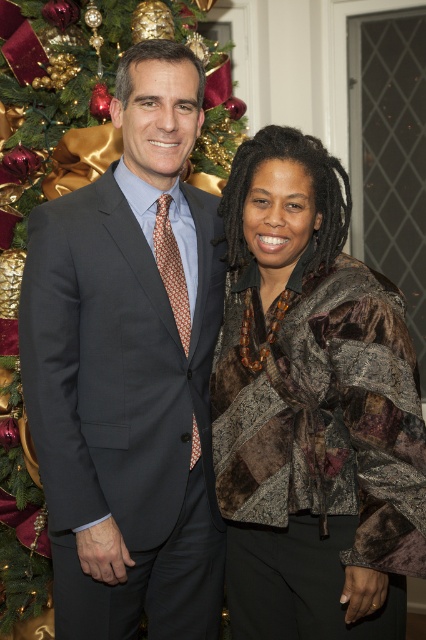
Is dark gray suit at center wider than brown patchwork jacket at center?

No.

Who is more forward, (173, 76) or (402, 515)?

Point (402, 515) is more forward.

Where is `dark gray suit at center`? The image size is (426, 640). dark gray suit at center is located at coordinates (129, 371).

This screenshot has width=426, height=640. Identify the location of dark gray suit at center. (129, 371).